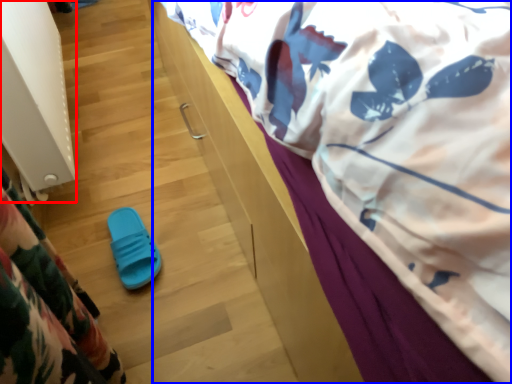
Question: Which object is further to the camera taking this photo, radiator (highlighted by a red box) or bed (highlighted by a blue box)?

Choices:
 (A) radiator
 (B) bed

Answer: (A)